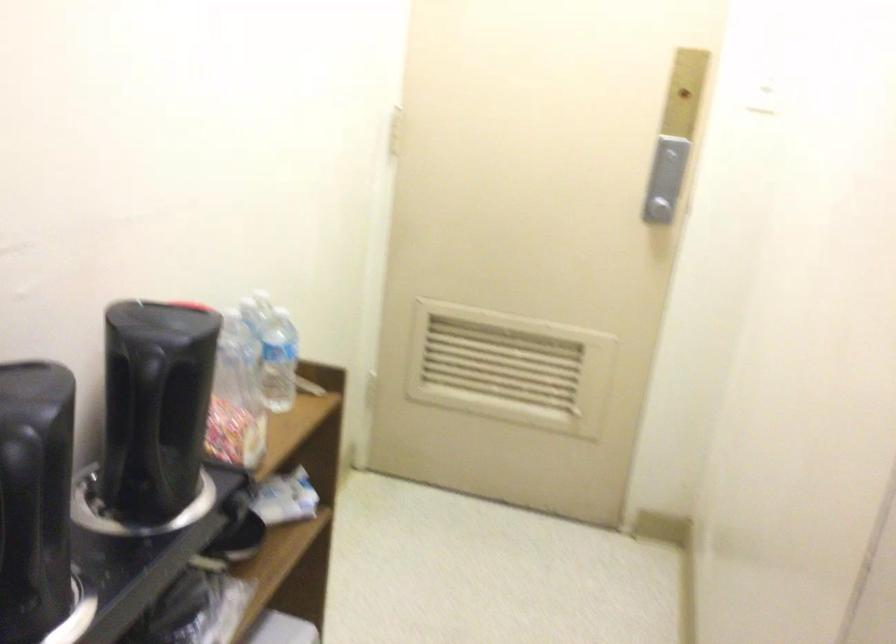
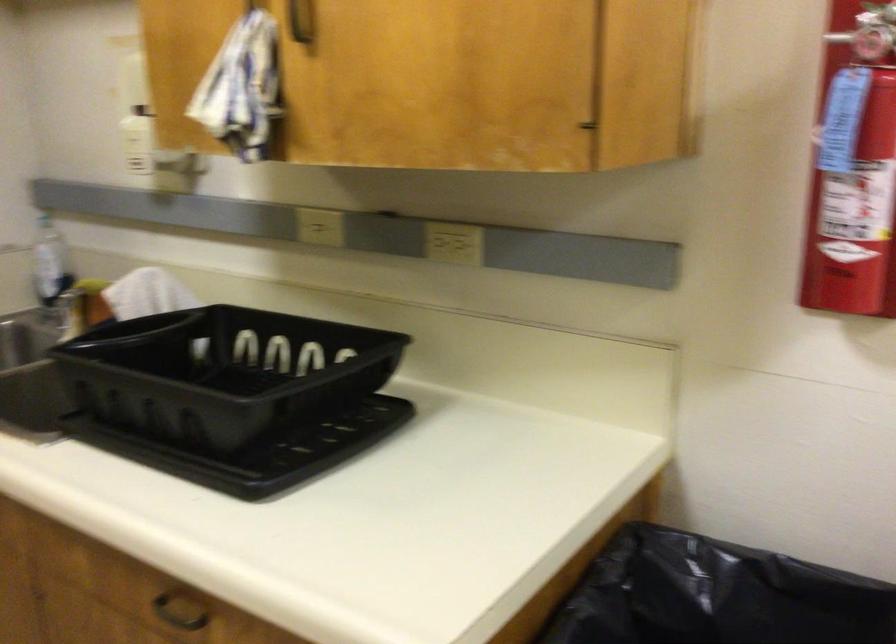
Question: The images are taken continuously from a first-person perspective. In which direction is your viewpoint rotating?

Choices:
 (A) Left
 (B) Right
 (C) Up
 (D) Down

Answer: (A)